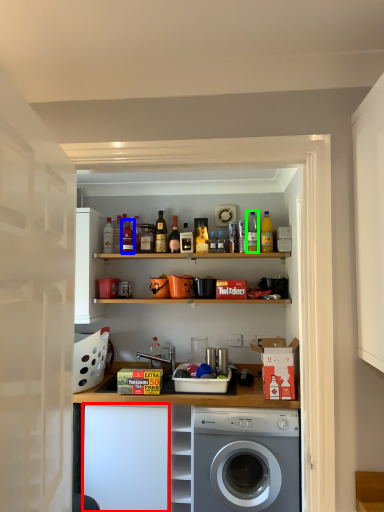
Question: Based on their relative distances, which object is nearer to cabinetry (highlighted by a red box)? Choose from bottle (highlighted by a blue box) and bottle (highlighted by a green box).

Choices:
 (A) bottle
 (B) bottle

Answer: (A)